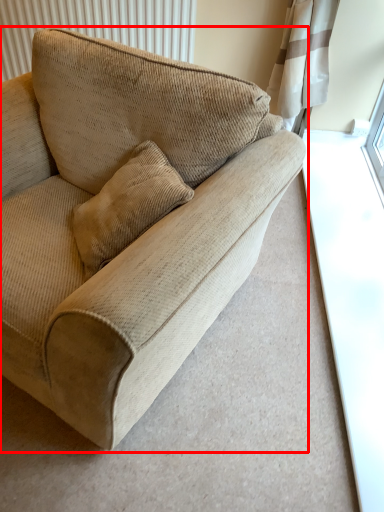
Question: From the image's perspective, where is studio couch (annotated by the red box) located relative to radiator?

Choices:
 (A) above
 (B) below

Answer: (B)